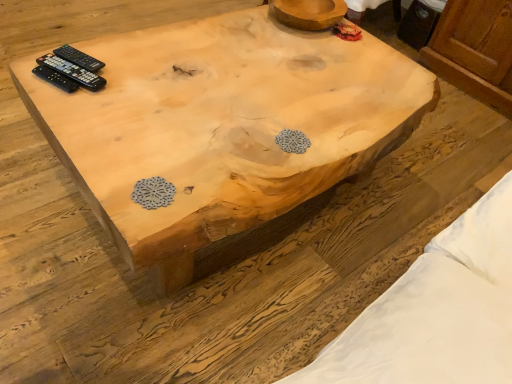
Question: Looking at the image, does black plastic remote controls at upper left, the second remote control when ordered from front to back, seem bigger or smaller compared to natural wood coffee table at center?

Choices:
 (A) big
 (B) small

Answer: (B)

Question: Considering the relative positions of black plastic remote controls at upper left, the second remote control when ordered from front to back, and natural wood coffee table at center in the image provided, is black plastic remote controls at upper left, the second remote control when ordered from front to back, to the left or to the right of natural wood coffee table at center?

Choices:
 (A) left
 (B) right

Answer: (A)

Question: Estimate the real-world distances between objects in this image. Which object is farther from the black plastic remote at upper left, arranged as the first remote control when viewed from the front?

Choices:
 (A) natural wood coffee table at center
 (B) black plastic remote controls at upper left, the second remote control from the back
 (C) black plastic remote control at upper left, the first remote control positioned from the back

Answer: (A)

Question: Which is nearer to the natural wood coffee table at center?

Choices:
 (A) black plastic remote control at upper left, the first remote control positioned from the back
 (B) black plastic remote controls at upper left, the second remote control when ordered from front to back
 (C) black plastic remote at upper left, the 3th remote control when ordered from back to front

Answer: (B)